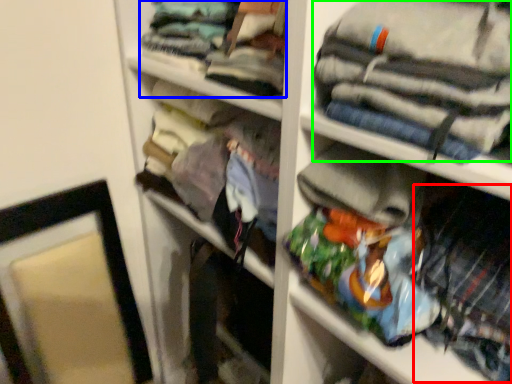
Question: Which object is the farthest from clothing (highlighted by a red box)? Choose among these: clothing (highlighted by a blue box) or clothing (highlighted by a green box).

Choices:
 (A) clothing
 (B) clothing

Answer: (A)